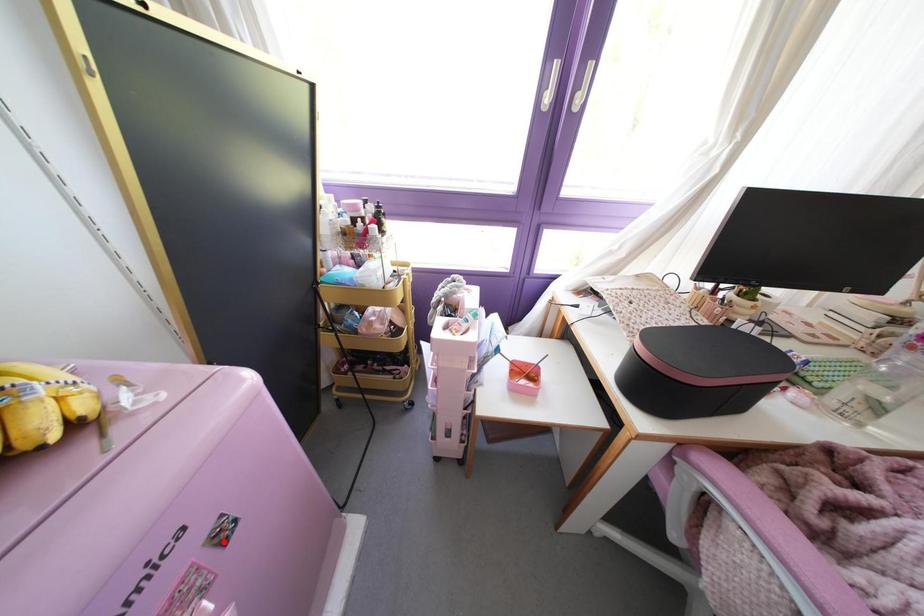
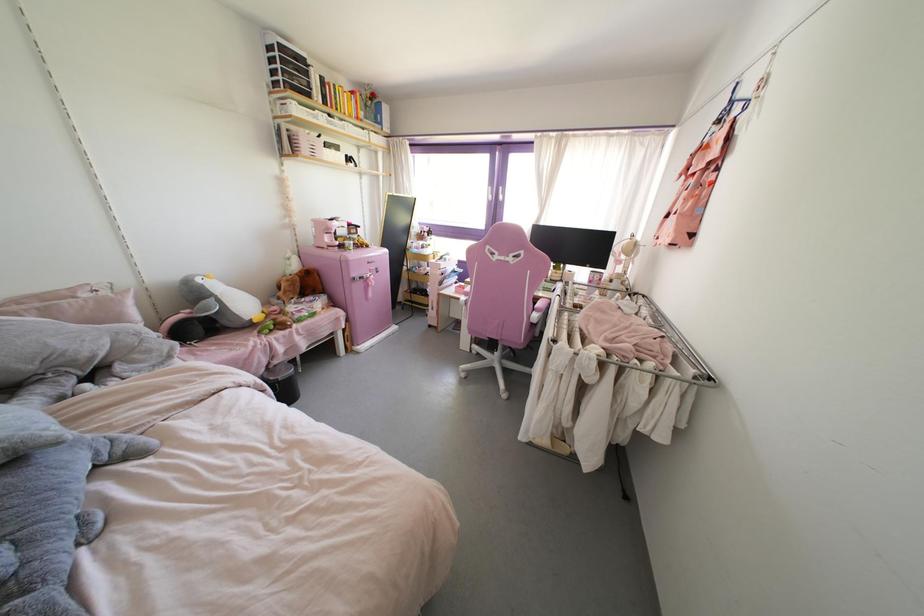
Question: I am providing you with two images of the same scene from different viewpoints. In image1, a red point is highlighted. Considering the same 3D point in image2, which of the following is correct?

Choices:
 (A) It is closer
 (B) It is farther

Answer: (A)